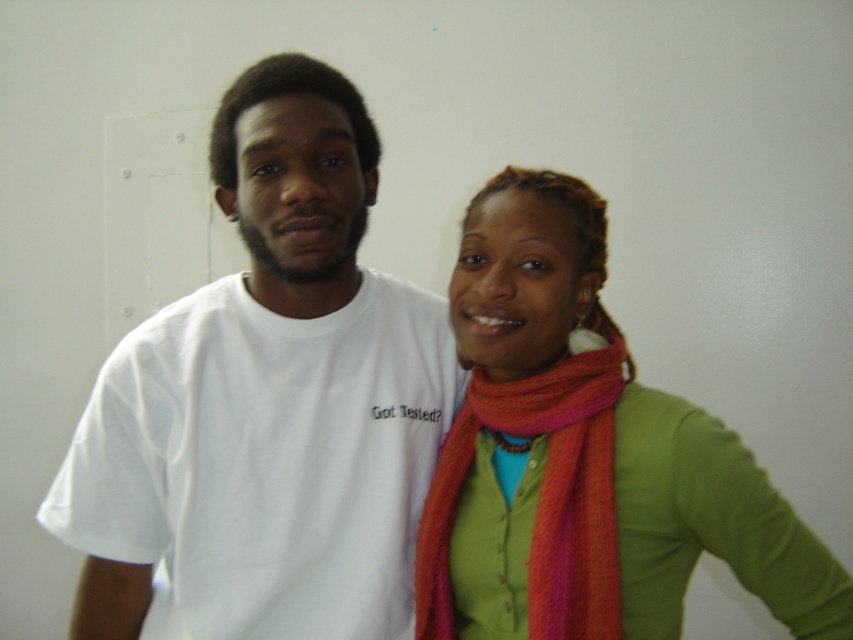
You are standing at a distance of 35.74 inches from the point marked at coordinates point [741,512]. If you want to take a photo of the two people in the image, will you be able to capture both of them in the frame without moving closer or farther away?

The distance between you and point [741,512] is 35.74 inches. Since both individuals are positioned at that point, you can capture them in the frame without needing to adjust your distance.